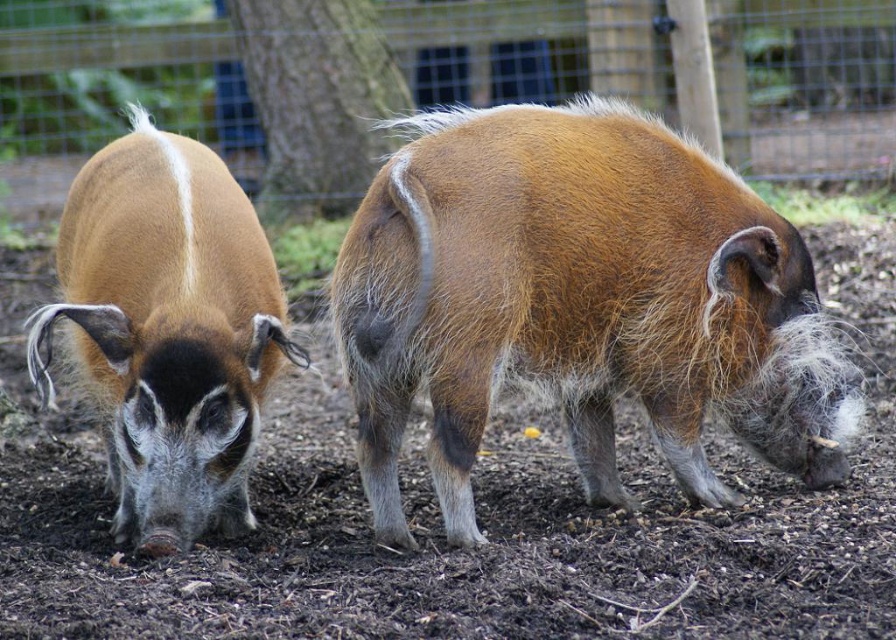
Question: Does metal wire fence at upper center appear on the left side of brown fuzzy pig at left?

Choices:
 (A) no
 (B) yes

Answer: (A)

Question: Is brown soft mud at center closer to camera compared to metal wire fence at upper center?

Choices:
 (A) no
 (B) yes

Answer: (B)

Question: Which object is farther from the camera taking this photo?

Choices:
 (A) brown fuzzy pig at left
 (B) brown fuzzy pig at center

Answer: (A)

Question: Where is brown fuzzy pig at center located in relation to metal wire fence at upper center in the image?

Choices:
 (A) left
 (B) right

Answer: (A)

Question: Among these objects, which one is farthest from the camera?

Choices:
 (A) brown soft mud at center
 (B) brown fuzzy pig at left

Answer: (B)

Question: Which is farther from the brown fuzzy pig at center?

Choices:
 (A) metal wire fence at upper center
 (B) brown soft mud at center

Answer: (A)